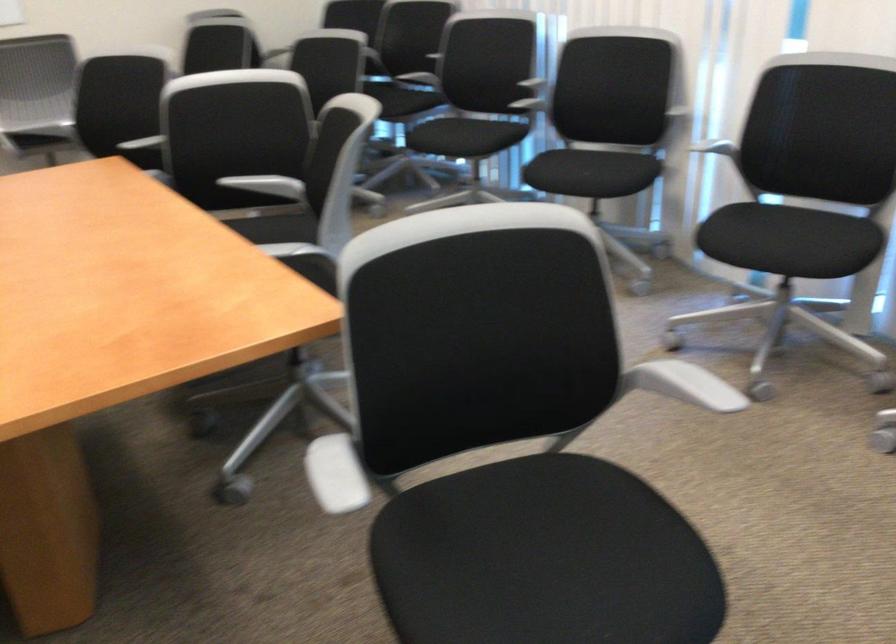
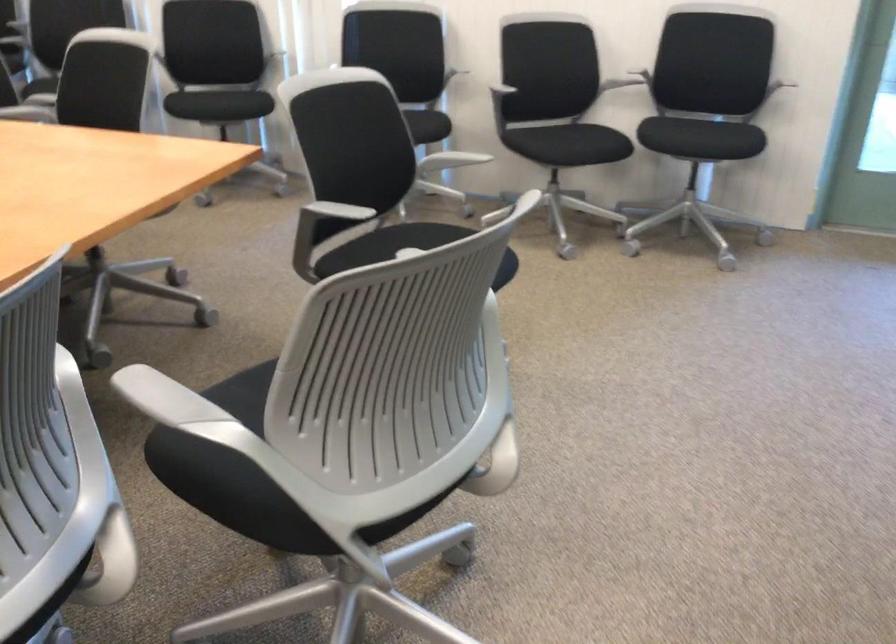
Question: I am providing you with two images of the same scene from different viewpoints. Please identify which objects are invisible in image2.

Choices:
 (A) gray adjustment knob
 (B) black chair sitting surface
 (C) black and white cup
 (D) gray chair armrest

Answer: (B)